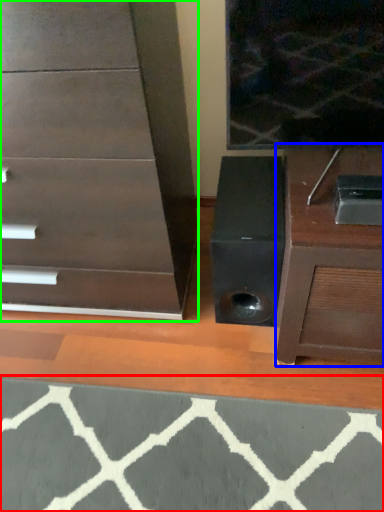
Question: Which object is positioned farthest from doormat (highlighted by a red box)? Select from furniture (highlighted by a blue box) and chest of drawers (highlighted by a green box).

Choices:
 (A) furniture
 (B) chest of drawers

Answer: (B)